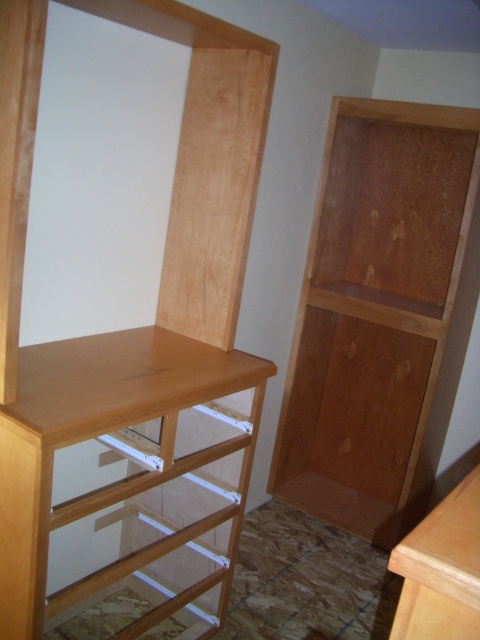
Which is more to the right, light brown wood bookshelf at left or natural wood bookshelf at right?

Positioned to the right is natural wood bookshelf at right.

Can you confirm if light brown wood bookshelf at left is thinner than natural wood bookshelf at right?

Correct, light brown wood bookshelf at left's width is less than natural wood bookshelf at right's.

This screenshot has width=480, height=640. What do you see at coordinates (132, 328) in the screenshot?
I see `light brown wood bookshelf at left` at bounding box center [132, 328].

Find the location of a particular element. light brown wood bookshelf at left is located at coordinates (132, 328).